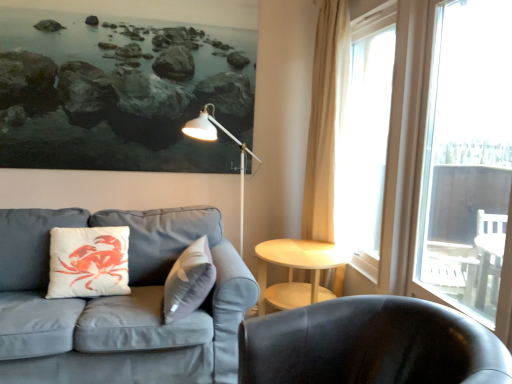
Question: From their relative heights in the image, would you say beige fabric curtain at right is taller or shorter than shiny black chair at lower right?

Choices:
 (A) short
 (B) tall

Answer: (B)

Question: Considering the positions of point (330, 142) and point (454, 339), is point (330, 142) closer or farther from the camera than point (454, 339)?

Choices:
 (A) farther
 (B) closer

Answer: (A)

Question: Which object is positioned farthest from the translucent glass window at right, positioned as the first window in back-to-front order?

Choices:
 (A) light wood/woodenobject at center
 (B) shiny black chair at lower right
 (C) white metal table lamp at upper center
 (D) white matte pillow at left
 (E) transparent glass window at right, the second window in the back-to-front sequence

Answer: (D)

Question: Based on their relative distances, which object is farther from the beige fabric curtain at right?

Choices:
 (A) shiny black chair at lower right
 (B) light wood/woodenobject at center
 (C) white metal table lamp at upper center
 (D) gray fabric couch at left
 (E) transparent glass window at right, the second window in the back-to-front sequence

Answer: (A)